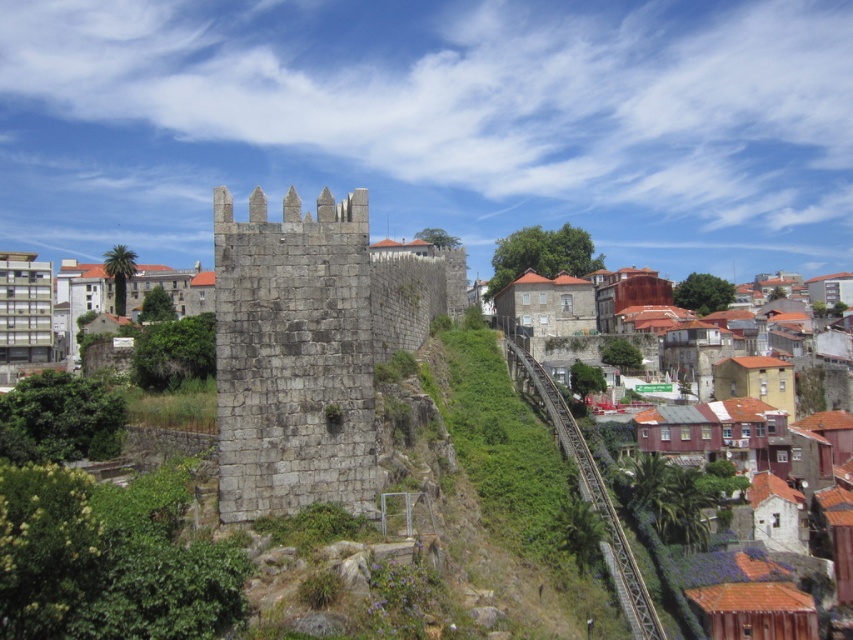
Question: Is gray stone wall at center further to the viewer compared to brown textured buildings at center-right?

Choices:
 (A) no
 (B) yes

Answer: (A)

Question: Which of the following is the closest to the observer?

Choices:
 (A) brown textured buildings at center-right
 (B) gray stone wall at center

Answer: (B)

Question: Can you confirm if gray stone wall at center is smaller than brown textured buildings at center-right?

Choices:
 (A) no
 (B) yes

Answer: (B)

Question: Which object appears farthest from the camera in this image?

Choices:
 (A) gray stone wall at center
 (B) brown textured buildings at center-right

Answer: (B)

Question: Is gray stone wall at center to the left of brown textured buildings at center-right from the viewer's perspective?

Choices:
 (A) yes
 (B) no

Answer: (A)

Question: Which of the following is the closest to the observer?

Choices:
 (A) brown textured buildings at center-right
 (B) gray stone wall at center

Answer: (B)